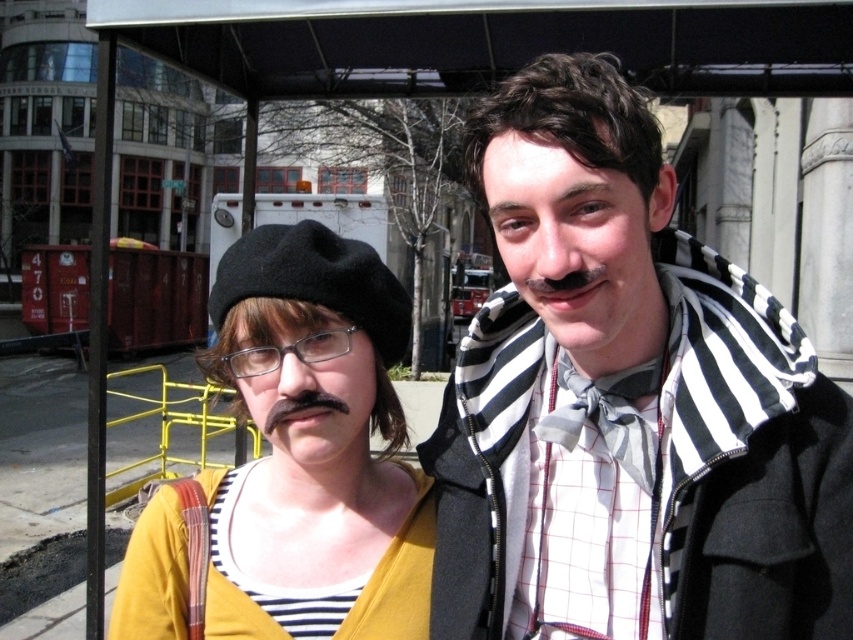
Can you confirm if striped scarf at center is positioned below yellow striped shirt at center?

No.

Where is `striped scarf at center`? striped scarf at center is located at coordinates pos(625,403).

This screenshot has height=640, width=853. I want to click on striped scarf at center, so click(625, 403).

Between yellow striped shirt at center and clear plastic glasses at center, which one has more height?

yellow striped shirt at center is taller.

Can you confirm if yellow striped shirt at center is wider than clear plastic glasses at center?

Indeed, yellow striped shirt at center has a greater width compared to clear plastic glasses at center.

Between point (357, 365) and point (345, 339), which one is positioned behind?

Point (357, 365)

Where is `yellow striped shirt at center`? yellow striped shirt at center is located at coordinates (312, 445).

Is the position of striped scarf at center less distant than that of clear plastic glasses at center?

That is True.

Is striped scarf at center smaller than clear plastic glasses at center?

Actually, striped scarf at center might be larger than clear plastic glasses at center.

Who is more distant from viewer, (x=799, y=346) or (x=268, y=372)?

Positioned behind is point (x=268, y=372).

This screenshot has width=853, height=640. What are the coordinates of `striped scarf at center` in the screenshot? It's located at (625, 403).